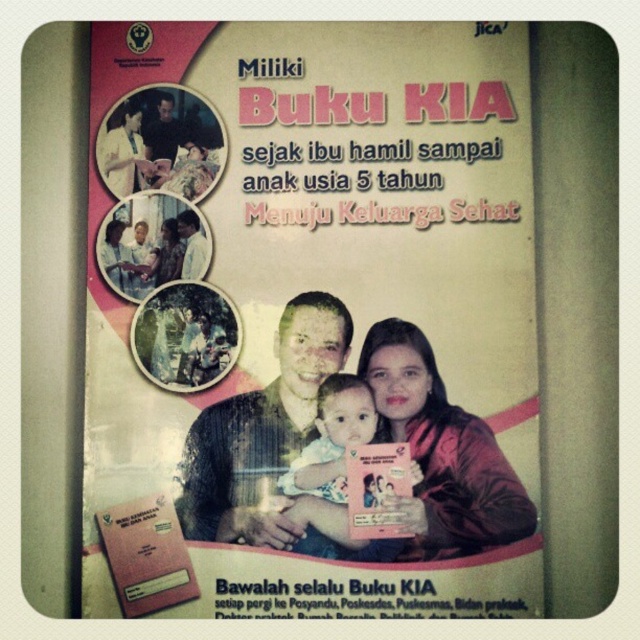
You are designing a poster layout for a health campaign and need to place the matte black laptop at upper left and the soft pink fabric baby at center. According to the spatial guidelines provided, which object should be placed closer to the viewer to maintain visual hierarchy?

The matte black laptop at upper left should be placed closer to the viewer since it is smaller than the soft pink fabric baby at center, helping to balance the visual weight and maintain hierarchy.

You are designing a layout for a poster and need to place the matte black laptop at upper left and the soft pink fabric baby at center. According to the poster design, which object is positioned to the left of the other?

The matte black laptop at upper left is to the left of the soft pink fabric baby at center.